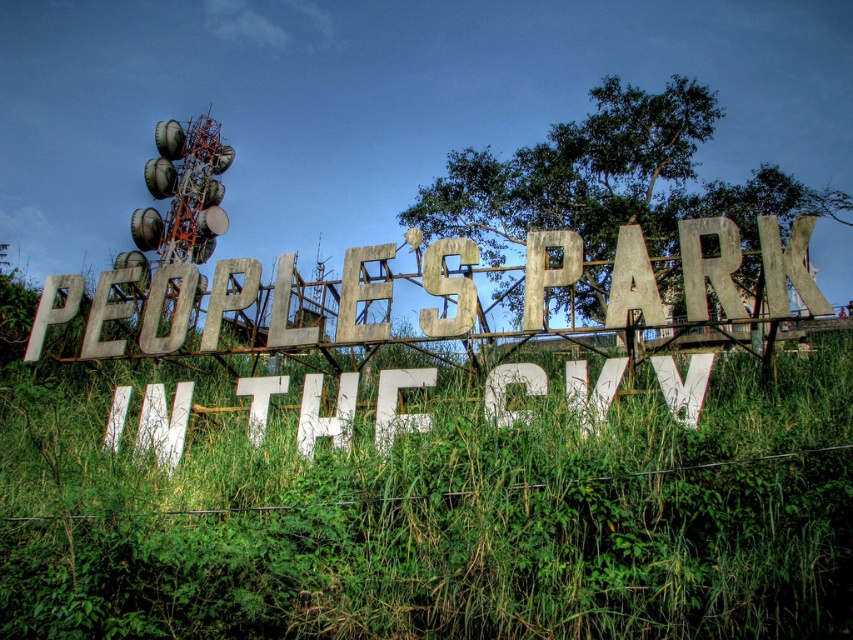
You are a landscape architect designing a pathway through the park. You need to decide whether to place the pathway between the green grass at center and the rusty metal fence at center. Given that the pathway requires a minimum width of 2 meters, can you determine if there is enough space between them?

The green grass at center is wider than the rusty metal fence at center. However, the description only provides a comparison of their widths, not their exact measurements. Without knowing the actual width of either object, it is impossible to determine if the space between them meets the 2 meter requirement.

You are standing in front of the signboard at PEOPLE S PARK IN THE CITY and want to determine the distance between the two points marked on the sign. Which point is closer to you, point (434, 557) or point (94, 298)?

Point (434, 557) is closer to the viewer than point (94, 298).

You are standing at the edge of the People Park in the City, where the signboard is located. You want to place a 3.5 meter long picnic blanket between the green grass at center and the rusty metal fence at center. Can the blanket fit between them without overlapping either object?

The distance between the green grass at center and the rusty metal fence at center is 3.68 meters. Since the picnic blanket is 3.5 meters long, it can fit between them without overlapping either object as there is enough space.